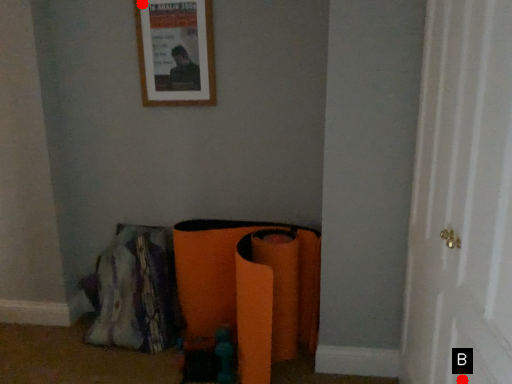
Question: Two points are circled on the image, labeled by A and B beside each circle. Which of the following is the farthest from the observer?

Choices:
 (A) A is further
 (B) B is further

Answer: (A)